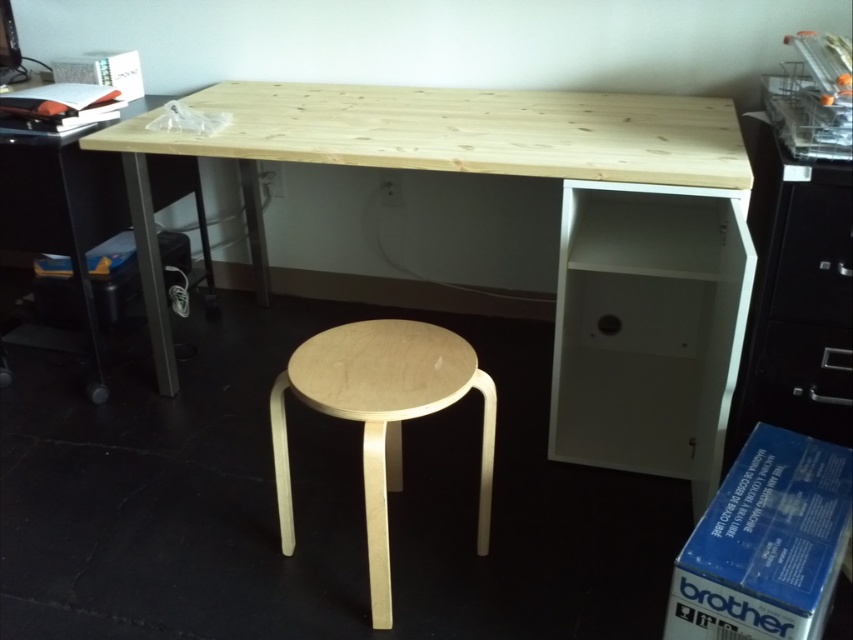
Does natural wood stool at center have a lesser height compared to matte white drawer at lower right?

No.

Is natural wood stool at center to the right of matte white drawer at lower right from the viewer's perspective?

In fact, natural wood stool at center is to the left of matte white drawer at lower right.

Does point (335, 408) come in front of point (836, 435)?

Yes.

You are a GUI agent. You are given a task and a screenshot of the screen. Output one action in this format:
    pyautogui.click(x=<x>, y=<y>)
    Task: Click on the natural wood stool at center
    This screenshot has height=640, width=853.
    Given the screenshot: What is the action you would take?
    pyautogui.click(x=380, y=417)

Looking at this image, who is more distant from viewer, (845, 387) or (608, 278)?

A: The point (608, 278) is behind.

This screenshot has width=853, height=640. What do you see at coordinates (796, 298) in the screenshot?
I see `black plastic file cabinet at right` at bounding box center [796, 298].

At what (x,y) coordinates should I click in order to perform the action: click on black plastic file cabinet at right. Please return your answer as a coordinate pair (x, y). This screenshot has width=853, height=640. Looking at the image, I should click on (796, 298).

Who is taller, natural wood desk at center or black plastic file cabinet at right?

With more height is natural wood desk at center.

Does natural wood desk at center have a larger size compared to black plastic file cabinet at right?

Indeed, natural wood desk at center has a larger size compared to black plastic file cabinet at right.

I want to click on natural wood desk at center, so click(428, 148).